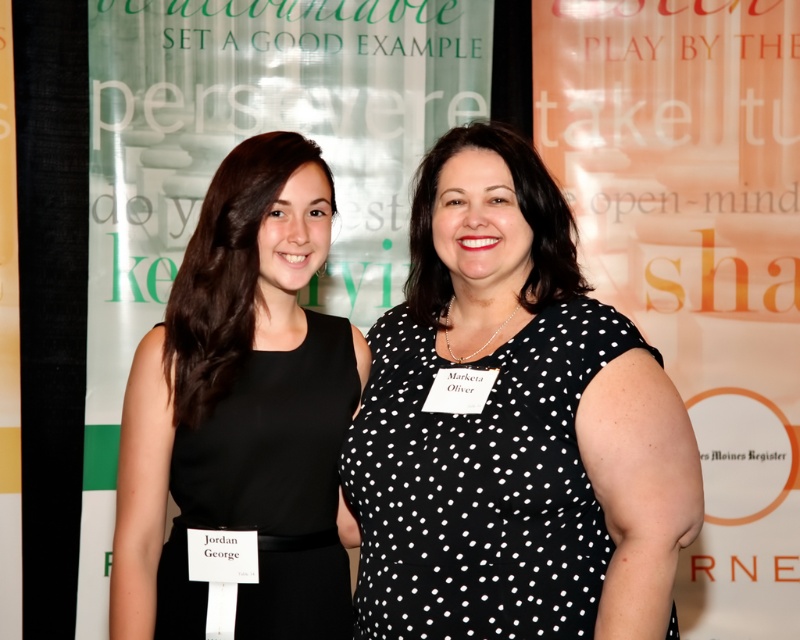
Question: Which point is closer to the camera?

Choices:
 (A) (354, 384)
 (B) (156, 259)

Answer: (A)

Question: Is black dotted dress at center further to the viewer compared to green fabric banner at upper center?

Choices:
 (A) yes
 (B) no

Answer: (B)

Question: Which point appears farthest from the camera in this image?

Choices:
 (A) (224, 433)
 (B) (400, 595)
 (C) (154, 51)

Answer: (C)

Question: Which of the following is the closest to the observer?

Choices:
 (A) (160, 260)
 (B) (332, 532)

Answer: (B)

Question: Can you confirm if black dotted dress at center is smaller than green fabric banner at upper center?

Choices:
 (A) yes
 (B) no

Answer: (A)

Question: Where is black dotted dress at center located in relation to black matte dress at left in the image?

Choices:
 (A) left
 (B) right

Answer: (B)